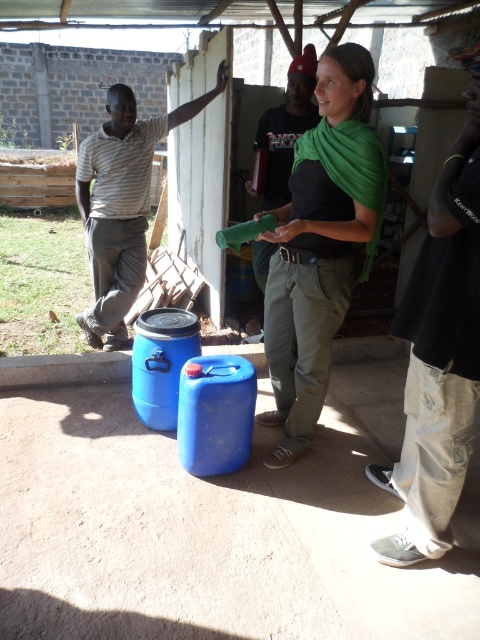
Question: Does black cotton shirt at center lie behind striped cotton shirt at left?

Choices:
 (A) no
 (B) yes

Answer: (A)

Question: Among these objects, which one is farthest from the camera?

Choices:
 (A) green matte scarf at center
 (B) striped cotton shirt at left
 (C) black cotton shirt at center

Answer: (B)

Question: Can you confirm if black cotton shirt at center is thinner than striped cotton shirt at left?

Choices:
 (A) no
 (B) yes

Answer: (B)

Question: Which point appears closest to the camera in this image?

Choices:
 (A) (340, 317)
 (B) (425, 378)
 (C) (136, 234)

Answer: (B)

Question: Which point is farther to the camera?

Choices:
 (A) (286, 227)
 (B) (104, 232)
 (C) (453, 442)

Answer: (B)

Question: Is green matte scarf at center wider than black cotton shirt at center?

Choices:
 (A) yes
 (B) no

Answer: (A)